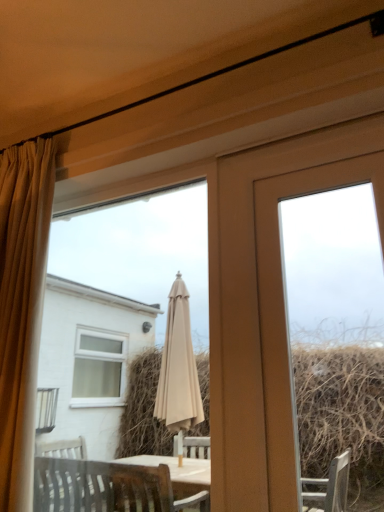
In the scene shown: In order to face beige fabric umbrella at center, should I rotate leftwards or rightwards?

A 14.252 degree turn to the left will do.

The height and width of the screenshot is (512, 384). I want to click on beige fabric umbrella at center, so click(117, 305).

What do you see at coordinates (117, 305) in the screenshot?
I see `beige fabric umbrella at center` at bounding box center [117, 305].

Measure the distance between point [193,256] and camera.

4.00 meters.

Image resolution: width=384 pixels, height=512 pixels. I want to click on beige fabric umbrella at center, so point(117,305).